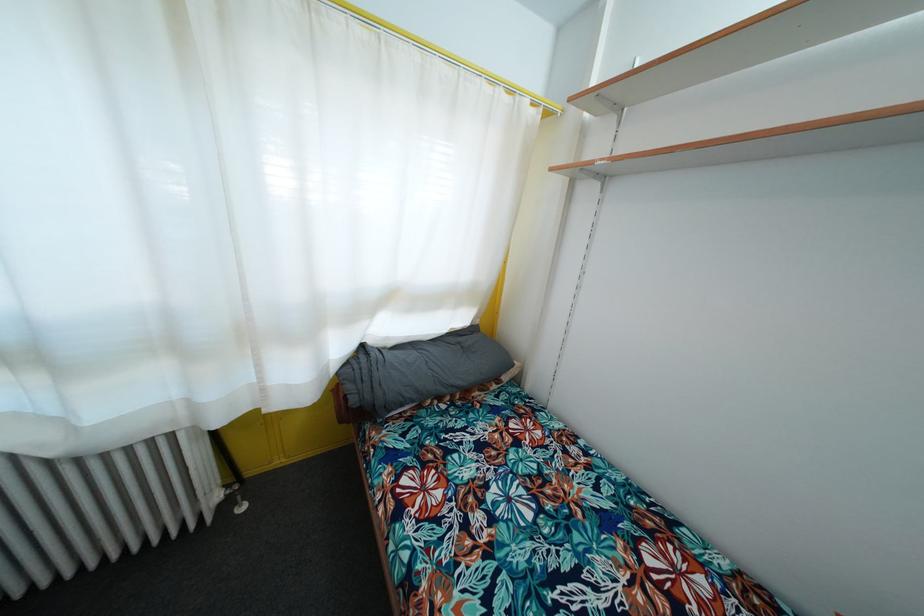
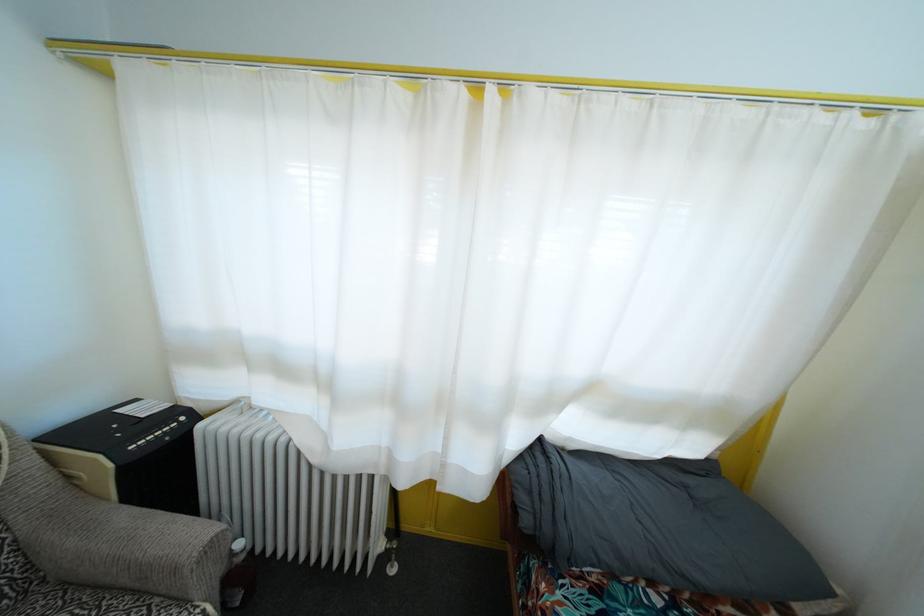
Question: The camera is either moving clockwise (left) or counter-clockwise (right) around the object. The first image is from the beginning of the video and the second image is from the end. Is the camera moving left or right when shooting the video?

Choices:
 (A) Left
 (B) Right

Answer: (B)